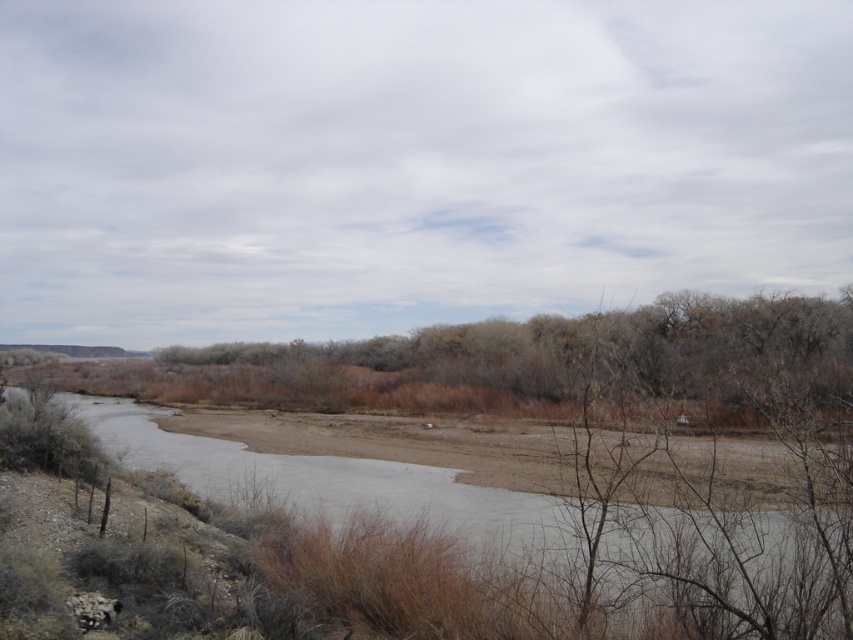
Question: Among these objects, which one is nearest to the camera?

Choices:
 (A) brown dirt at lower center
 (B) brown/dry grass at center

Answer: (A)

Question: Is brown dirt at lower center to the left of brown/dry grass at center from the viewer's perspective?

Choices:
 (A) no
 (B) yes

Answer: (A)

Question: Does brown dirt at lower center appear on the left side of brown/dry grass at center?

Choices:
 (A) no
 (B) yes

Answer: (A)

Question: Which of the following is the farthest from the observer?

Choices:
 (A) brown dirt at lower center
 (B) brown/dry grass at center

Answer: (B)

Question: Is brown dirt at lower center to the left of brown/dry grass at center from the viewer's perspective?

Choices:
 (A) no
 (B) yes

Answer: (A)